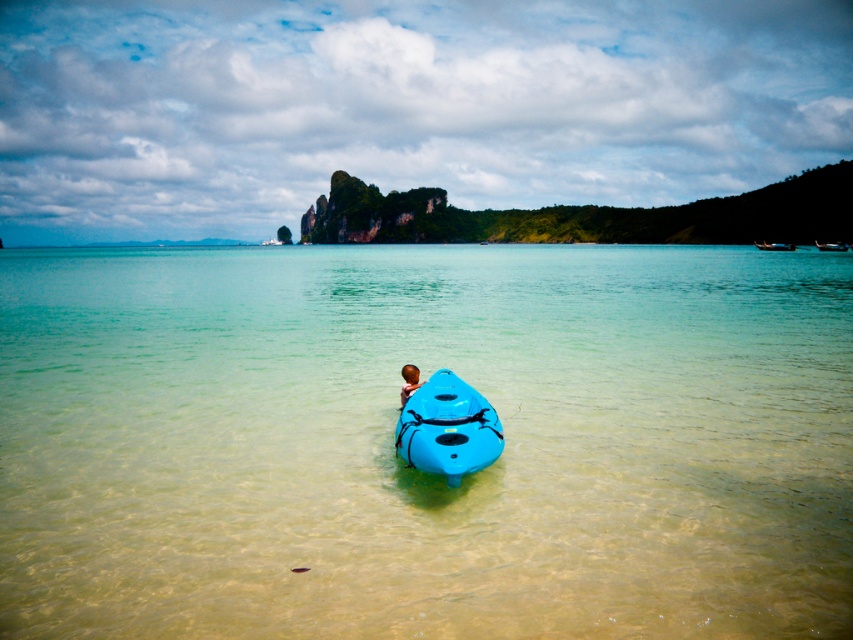
Is clear plastic water at center behind brown hair at center?

That is False.

Who is lower down, clear plastic water at center or brown hair at center?

Positioned lower is brown hair at center.

Between point (120, 608) and point (409, 387), which one is positioned behind?

Point (409, 387)

Locate an element on the screen. Image resolution: width=853 pixels, height=640 pixels. clear plastic water at center is located at coordinates click(410, 468).

Is clear plastic water at center to the left of wooden canoe at upper right from the viewer's perspective?

Yes, clear plastic water at center is to the left of wooden canoe at upper right.

Does clear plastic water at center have a larger size compared to wooden canoe at upper right?

Correct, clear plastic water at center is larger in size than wooden canoe at upper right.

This screenshot has height=640, width=853. What do you see at coordinates (410, 468) in the screenshot?
I see `clear plastic water at center` at bounding box center [410, 468].

Where is `clear plastic water at center`? clear plastic water at center is located at coordinates (410, 468).

Between brown hair at center and blue plastic kayak at center, which one appears on the right side from the viewer's perspective?

Positioned to the right is blue plastic kayak at center.

What do you see at coordinates (409, 381) in the screenshot? I see `brown hair at center` at bounding box center [409, 381].

The image size is (853, 640). I want to click on brown hair at center, so click(x=409, y=381).

Find the location of `brown hair at center`. brown hair at center is located at coordinates (409, 381).